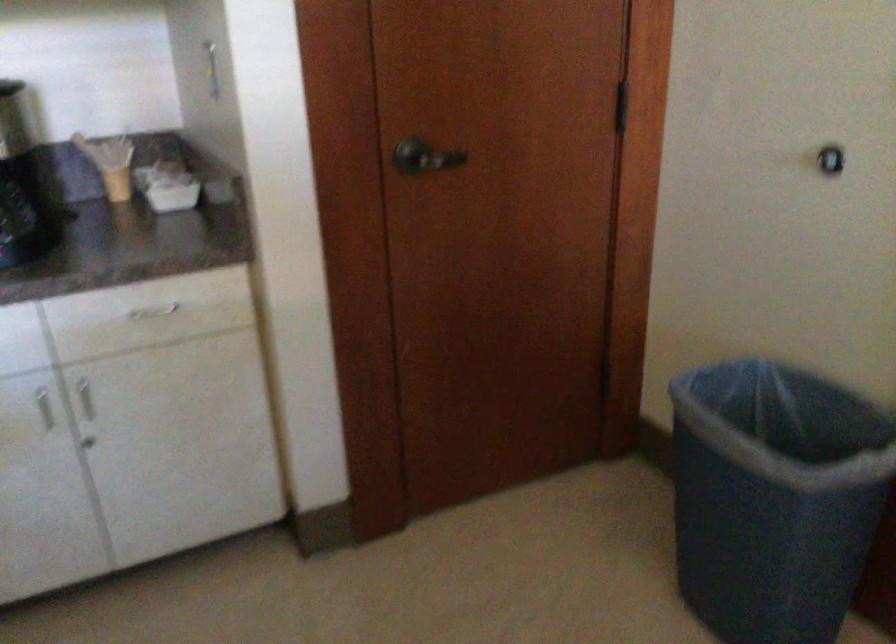
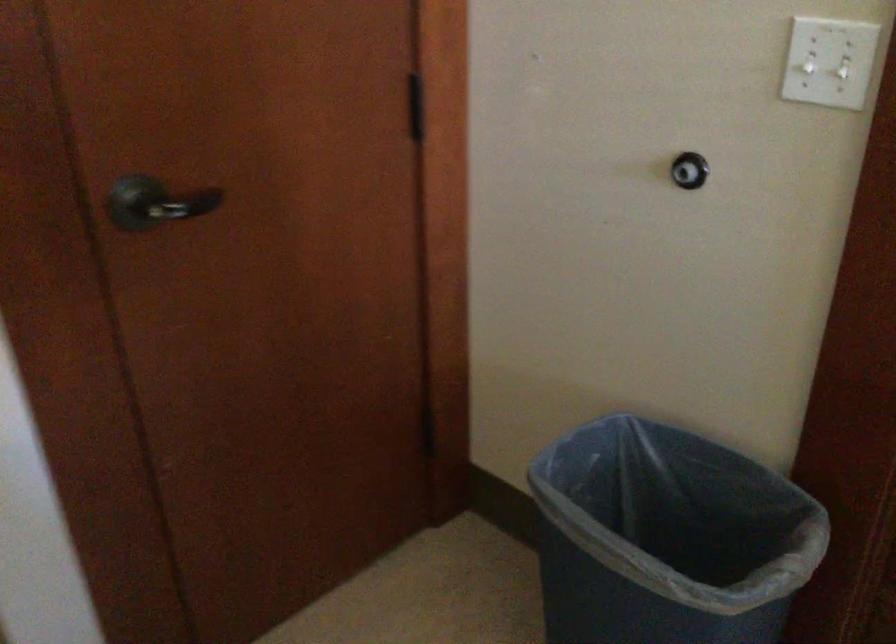
Question: The camera is either moving clockwise (left) or counter-clockwise (right) around the object. The first image is from the beginning of the video and the second image is from the end. Is the camera moving left or right when shooting the video?

Choices:
 (A) Left
 (B) Right

Answer: (A)